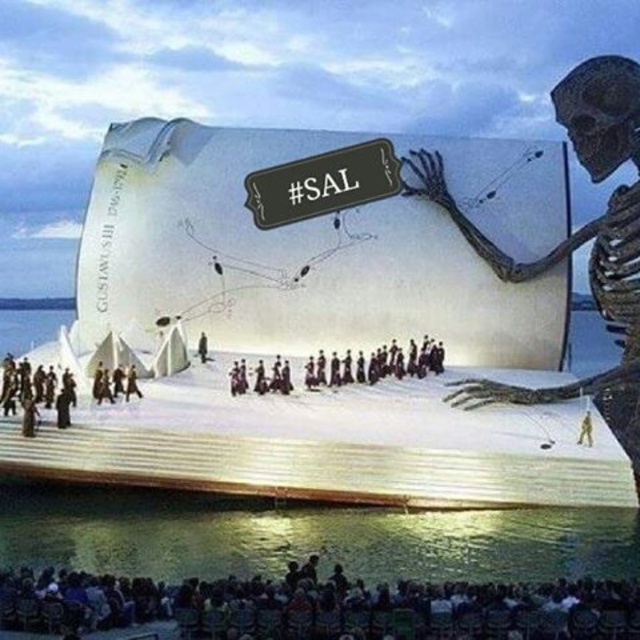
Which is in front, point (604, 138) or point (420, 376)?

Point (604, 138)

Does point (563, 106) come in front of point (310, 388)?

No, (563, 106) is behind (310, 388).

In order to click on skeletalmaterial/texture at right in this screenshot , I will do `click(577, 241)`.

Based on the photo, who is higher up, clear water at stage bottom or skeletalmaterial/texture at right?

Positioned higher is skeletalmaterial/texture at right.

At what (x,y) coordinates should I click in order to perform the action: click on clear water at stage bottom. Please return your answer as a coordinate pair (x, y). This screenshot has height=640, width=640. Looking at the image, I should click on (305, 536).

Does clear water at stage bottom have a lesser width compared to dark brown uniform at center?

No, clear water at stage bottom is not thinner than dark brown uniform at center.

Is clear water at stage bottom smaller than dark brown uniform at center?

Actually, clear water at stage bottom might be larger than dark brown uniform at center.

Who is more forward, [360,515] or [426,348]?

Point [360,515] is more forward.

Find the location of a particular element. clear water at stage bottom is located at coordinates 305,536.